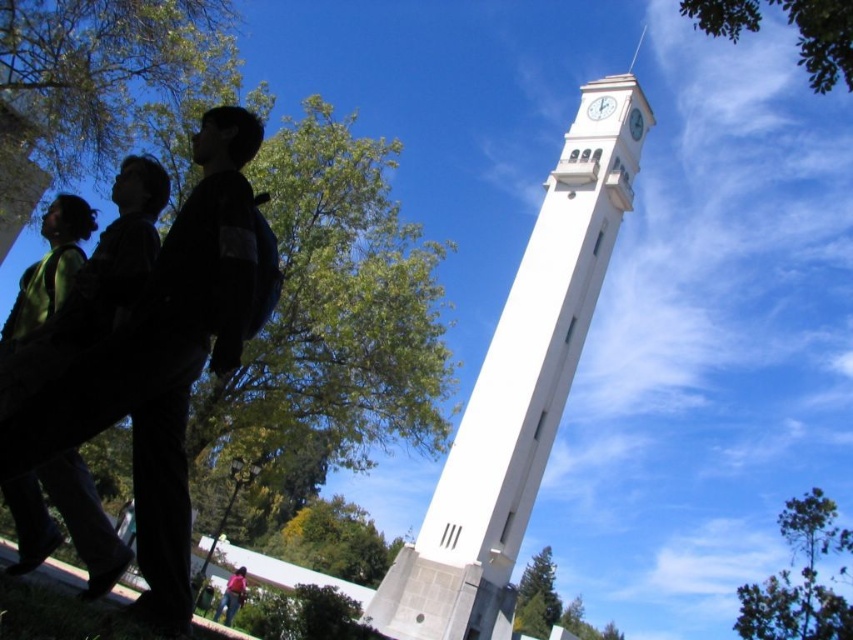
Can you confirm if pink fabric pants at lower center is shorter than white smooth clock at upper center?

Indeed, pink fabric pants at lower center has a lesser height compared to white smooth clock at upper center.

Does pink fabric pants at lower center have a greater height compared to white smooth clock at upper center?

In fact, pink fabric pants at lower center may be shorter than white smooth clock at upper center.

Between point (225, 625) and point (633, 109), which one is positioned in front?

Positioned in front is point (225, 625).

Where is `pink fabric pants at lower center`? The height and width of the screenshot is (640, 853). pink fabric pants at lower center is located at coordinates (231, 595).

Who is positioned more to the right, white concrete clock tower at center or white smooth clock at upper center?

Positioned to the right is white smooth clock at upper center.

Is point (494, 563) more distant than point (636, 122)?

No, it is in front of (636, 122).

Find the location of a particular element. This screenshot has height=640, width=853. white concrete clock tower at center is located at coordinates (518, 392).

Is white concrete clock tower at center positioned before pink fabric pants at lower center?

Yes, it is.

Is white concrete clock tower at center behind pink fabric pants at lower center?

No, white concrete clock tower at center is closer to the viewer.

This screenshot has width=853, height=640. What do you see at coordinates (518, 392) in the screenshot?
I see `white concrete clock tower at center` at bounding box center [518, 392].

You are a GUI agent. You are given a task and a screenshot of the screen. Output one action in this format:
    pyautogui.click(x=<x>, y=<y>)
    Task: Click on the white concrete clock tower at center
    The image size is (853, 640).
    Given the screenshot: What is the action you would take?
    point(518,392)